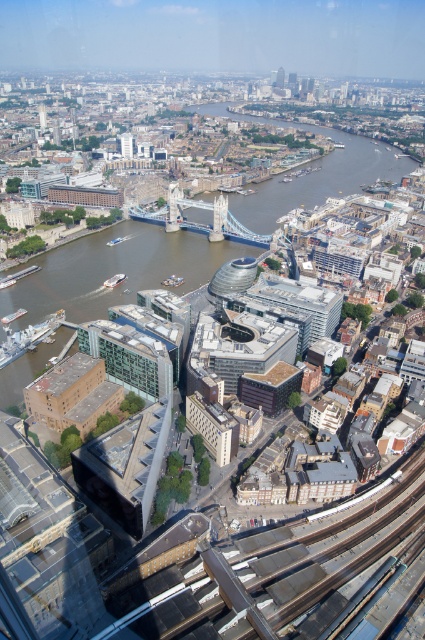
You are a drone operator flying over the city. You see the brown water at center and the green glass windows at center. Which object is located to the left of the other?

The green glass windows at center are located to the left of the brown water at center because the brown water at center is positioned on the right side of the green glass windows at center.

You are a drone operator tasked with capturing a photo of the matte gray tower at upper center and the silver metallic bridge at center. Your drone can only fly within a 200 meter radius. Will you be able to capture both landmarks in a single photo without moving the drone?

The silver metallic bridge at center is 242.71 meters away from the matte gray tower at upper center, which exceeds the 200 meter radius limit. Therefore, you cannot capture both landmarks in a single photo without moving the drone.

You are a drone operator trying to capture a photo of the brown water at center from a safe distance. The minimum safe distance for your drone is 150 meters. Can you confirm if the drone can safely take the photo?

The brown water at center is 160.00 meters away from camera, so yes, the drone can safely take the photo as it is beyond the minimum safe distance of 150 meters.